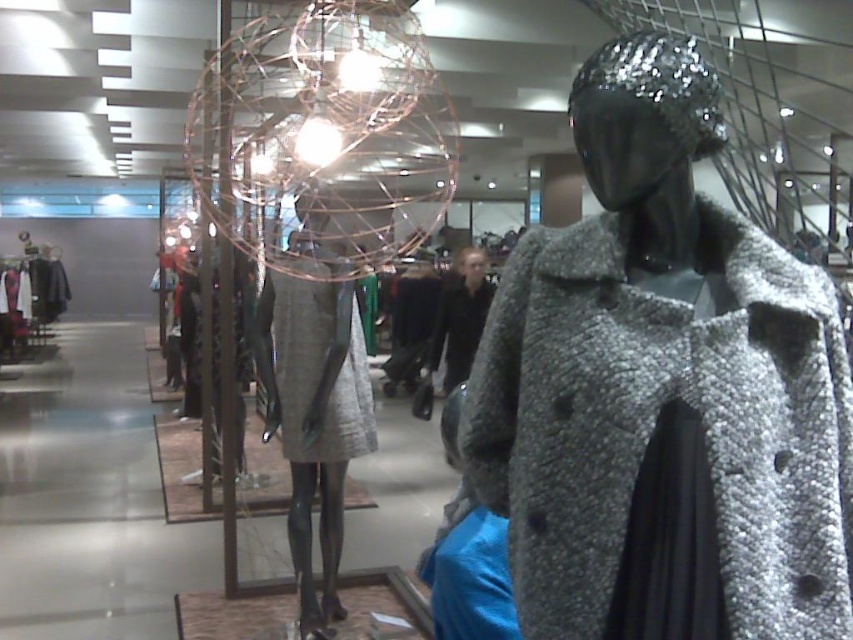
Question: Which of the following is the closest to the observer?

Choices:
 (A) (343, 332)
 (B) (318, 442)

Answer: (A)

Question: Considering the relative positions of sparkly silver coat at center and matte gray skirt at center in the image provided, where is sparkly silver coat at center located with respect to matte gray skirt at center?

Choices:
 (A) left
 (B) right

Answer: (B)

Question: Can you confirm if sparkly silver coat at center is smaller than gray woolen coat at center?

Choices:
 (A) no
 (B) yes

Answer: (B)

Question: Based on their relative distances, which object is farther from the gray woolen coat at center?

Choices:
 (A) matte gray skirt at center
 (B) sparkly silver coat at center

Answer: (B)

Question: Which of the following is the closest to the observer?

Choices:
 (A) (518, 556)
 (B) (316, 372)

Answer: (A)

Question: Can you confirm if matte gray skirt at center is positioned to the left of gray woolen coat at center?

Choices:
 (A) no
 (B) yes

Answer: (B)